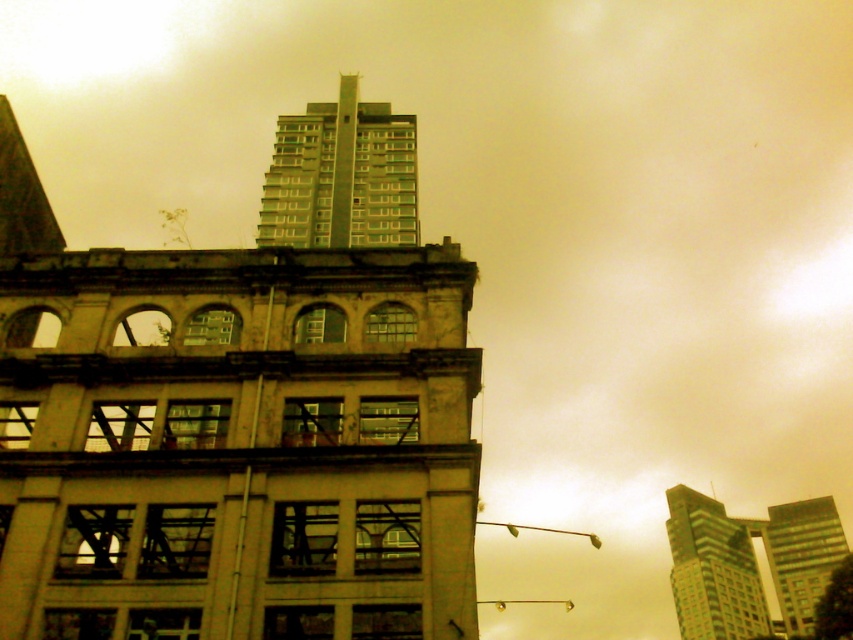
You are standing at the point marked by coordinates point (712, 570) in the image. What is the nearest object to you?

The nearest object to you is the green glass building at upper right represented by point (712, 570).

You are an architect analyzing the urban skyline. You observe the green glass building at upper center and the green glass building at upper right. Which of these two buildings appears to be closer in size to the older classical building in the foreground?

The green glass building at upper center is smaller than the green glass building at upper right. Since the older classical building in the foreground is likely of moderate size compared to the modern high rises, the green glass building at upper center might be closer in size to the older classical building.

You are an architect analyzing the urban skyline. You observe the green glass building at upper center and the green glass building at upper right. Which of these two buildings would cast a longer shadow at noon? Please explain your reasoning based on their positions and the scene description.

The green glass building at upper center is much taller than the green glass building at upper right. Since taller buildings generally cast longer shadows, the green glass building at upper center would cast a longer shadow at noon.